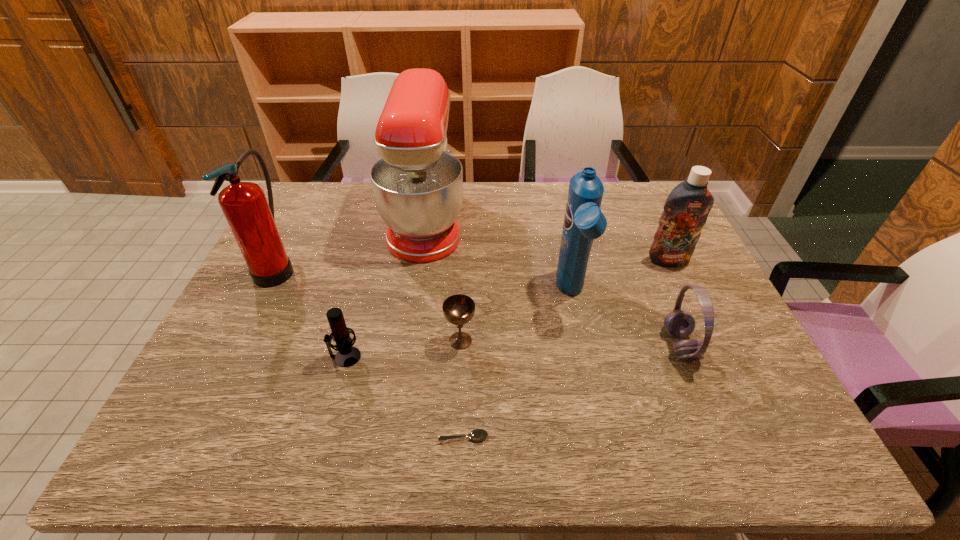
In order to click on free space between the headset and the second shortest object in this screenshot , I will do `click(570, 343)`.

Locate an element on the screen. This screenshot has width=960, height=540. vacant region between the nearer shampoo and the second shortest object is located at coordinates (516, 317).

Identify the location of free space between the taller shampoo and the fourth tallest object. This screenshot has height=540, width=960. (620, 276).

Where is `free space between the seventh tallest object and the shorter shampoo`? The width and height of the screenshot is (960, 540). free space between the seventh tallest object and the shorter shampoo is located at coordinates (564, 300).

You are a GUI agent. You are given a task and a screenshot of the screen. Output one action in this format:
    pyautogui.click(x=<x>, y=<y>)
    Task: Click on the empty location between the microphone and the mixer
    This screenshot has height=540, width=960.
    Given the screenshot: What is the action you would take?
    pyautogui.click(x=386, y=289)

You are a GUI agent. You are given a task and a screenshot of the screen. Output one action in this format:
    pyautogui.click(x=<x>, y=<y>)
    Task: Click on the vacant region between the mixer and the leftmost object
    
    Given the screenshot: What is the action you would take?
    pyautogui.click(x=351, y=245)

The height and width of the screenshot is (540, 960). I want to click on empty location between the mixer and the headset, so click(x=553, y=284).

At what (x,y) coordinates should I click in order to perform the action: click on vacant space that's between the chalice and the microphone. Please return your answer as a coordinate pair (x, y). This screenshot has width=960, height=540. Looking at the image, I should click on (403, 349).

Locate an element on the screen. empty space between the headset and the soupspoon is located at coordinates (571, 391).

You are a GUI agent. You are given a task and a screenshot of the screen. Output one action in this format:
    pyautogui.click(x=<x>, y=<y>)
    Task: Click on the free space between the leftmost object and the soupspoon
    This screenshot has height=540, width=960.
    Given the screenshot: What is the action you would take?
    pyautogui.click(x=371, y=352)